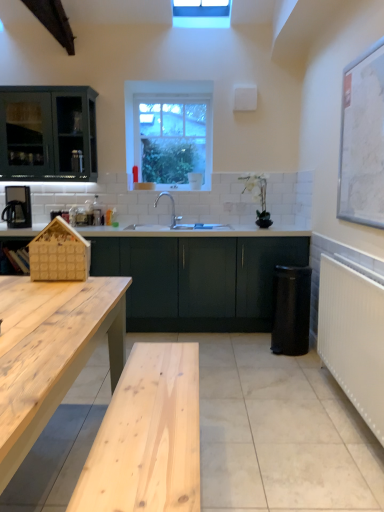
Question: Does natural wood table at left have a smaller size compared to clear glass window at upper center?

Choices:
 (A) yes
 (B) no

Answer: (B)

Question: Considering the relative positions of natural wood table at left and clear glass window at upper center in the image provided, is natural wood table at left to the left of clear glass window at upper center from the viewer's perspective?

Choices:
 (A) no
 (B) yes

Answer: (B)

Question: Can you confirm if natural wood table at left is thinner than clear glass window at upper center?

Choices:
 (A) no
 (B) yes

Answer: (A)

Question: Is natural wood table at left touching clear glass window at upper center?

Choices:
 (A) no
 (B) yes

Answer: (A)

Question: Is natural wood table at left completely or partially outside of clear glass window at upper center?

Choices:
 (A) no
 (B) yes

Answer: (B)

Question: Is natural wood table at left to the right of clear glass window at upper center from the viewer's perspective?

Choices:
 (A) no
 (B) yes

Answer: (A)

Question: Is matte green cabinet at center far from matte black kettle at left?

Choices:
 (A) yes
 (B) no

Answer: (A)

Question: Considering the relative sizes of matte green cabinet at center and matte black kettle at left in the image provided, is matte green cabinet at center wider than matte black kettle at left?

Choices:
 (A) no
 (B) yes

Answer: (B)

Question: Is matte green cabinet at center taller than matte black kettle at left?

Choices:
 (A) no
 (B) yes

Answer: (B)

Question: Would you say matte green cabinet at center contains matte black kettle at left?

Choices:
 (A) no
 (B) yes

Answer: (A)

Question: Considering the relative sizes of matte green cabinet at center and matte black kettle at left in the image provided, is matte green cabinet at center thinner than matte black kettle at left?

Choices:
 (A) no
 (B) yes

Answer: (A)

Question: Is matte green cabinet at center closer to camera compared to matte black kettle at left?

Choices:
 (A) yes
 (B) no

Answer: (A)

Question: Can you confirm if white textured radiator at right is smaller than matte black kettle at left?

Choices:
 (A) yes
 (B) no

Answer: (B)